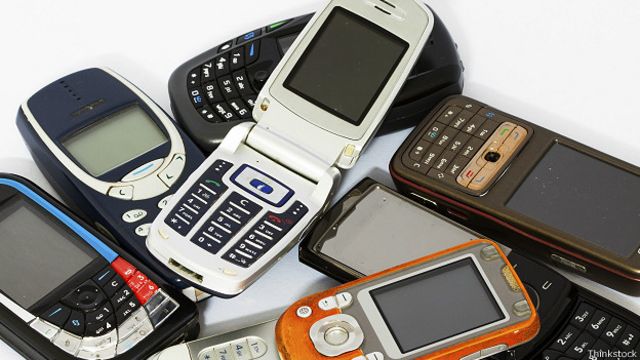
I want to click on phones, so click(262, 186), click(221, 88), click(113, 128), click(60, 258), click(355, 327), click(582, 322), click(580, 214).